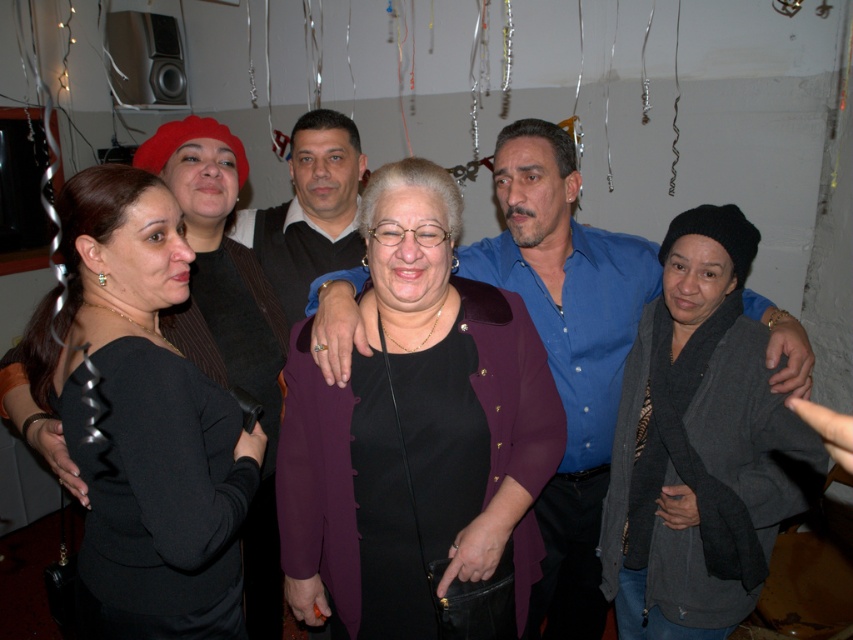
You are a photographer at a social event. You want to take a photo of the purple matte jacket at center and the matte black vest at center. The camera you are using has a minimum focus distance of 70 centimeters. Will both items be in focus if you position the camera to capture both?

The purple matte jacket at center and matte black vest at center are 77.57 centimeters apart from each other. Since the distance between them is greater than the camera minimum focus distance of 70 centimeters, both items will be in focus if positioned correctly.

Where is the black matte dress at left located in the image?

The black matte dress at left is located at point (141, 420) in the image.

You are standing in the room and want to locate the purple matte jacket at center. According to the coordinates provided, where would you find it?

The purple matte jacket at center is located at coordinates point (415,428).